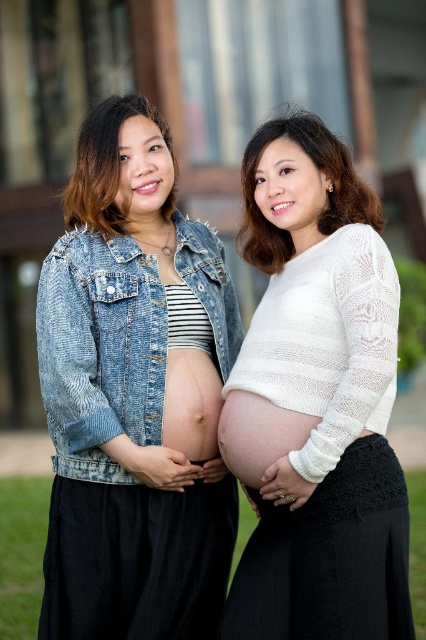
Is denim jacket at left further to camera compared to matte skin at center?

Yes, it is behind matte skin at center.

Locate an element on the screen. denim jacket at left is located at coordinates (108, 166).

The height and width of the screenshot is (640, 426). I want to click on denim jacket at left, so click(x=108, y=166).

Is faded denim jacket at lower right behind white lace sweater at center?

No, it is in front of white lace sweater at center.

Is faded denim jacket at lower right thinner than white lace sweater at center?

Incorrect, faded denim jacket at lower right's width is not less than white lace sweater at center's.

I want to click on faded denim jacket at lower right, so click(x=100, y=352).

Does white knitted sweater at center appear under denim jacket at left?

Correct, white knitted sweater at center is located below denim jacket at left.

Which of these two, white knitted sweater at center or denim jacket at left, stands shorter?

Standing shorter between the two is denim jacket at left.

Which is behind, point (236, 365) or point (98, 195)?

Positioned behind is point (98, 195).

The height and width of the screenshot is (640, 426). Find the location of `white knitted sweater at center`. white knitted sweater at center is located at coordinates (316, 401).